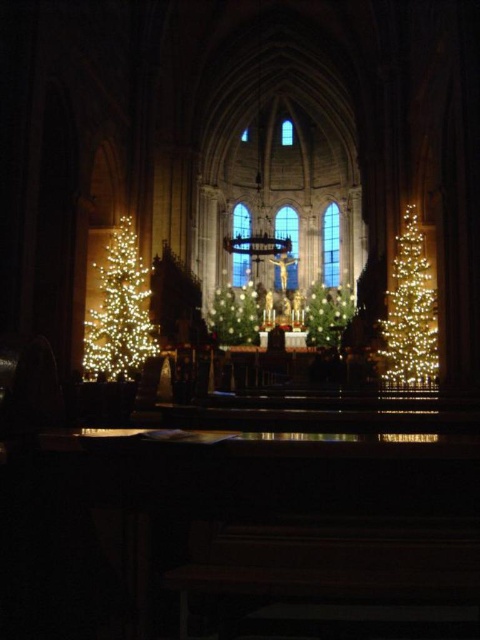
Question: Which object is farther from the camera taking this photo?

Choices:
 (A) illuminated plastic christmas tree at left
 (B) illuminated artificial christmas tree at center
 (C) illuminated wireframe at right

Answer: (B)

Question: Does illuminated wireframe at right appear over illuminated artificial christmas tree at center?

Choices:
 (A) yes
 (B) no

Answer: (B)

Question: Does green matte christmas tree at center appear over illuminated artificial christmas tree at center?

Choices:
 (A) yes
 (B) no

Answer: (B)

Question: Is illuminated plastic christmas tree at left bigger than illuminated artificial christmas tree at center?

Choices:
 (A) yes
 (B) no

Answer: (B)

Question: Which is farther from the illuminated artificial christmas tree at center?

Choices:
 (A) illuminated plastic christmas tree at left
 (B) illuminated wireframe at right
 (C) green matte christmas tree at center

Answer: (A)

Question: Which of these objects is positioned farthest from the illuminated artificial christmas tree at center?

Choices:
 (A) illuminated wireframe at right
 (B) green matte christmas tree at center
 (C) illuminated plastic christmas tree at left

Answer: (C)